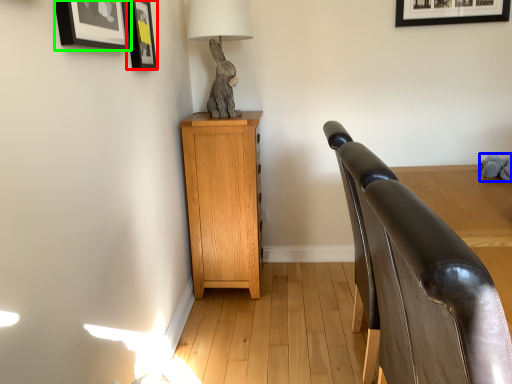
Question: Which object is positioned farthest from picture frame (highlighted by a red box)? Select from animal (highlighted by a blue box) and picture frame (highlighted by a green box).

Choices:
 (A) animal
 (B) picture frame

Answer: (A)